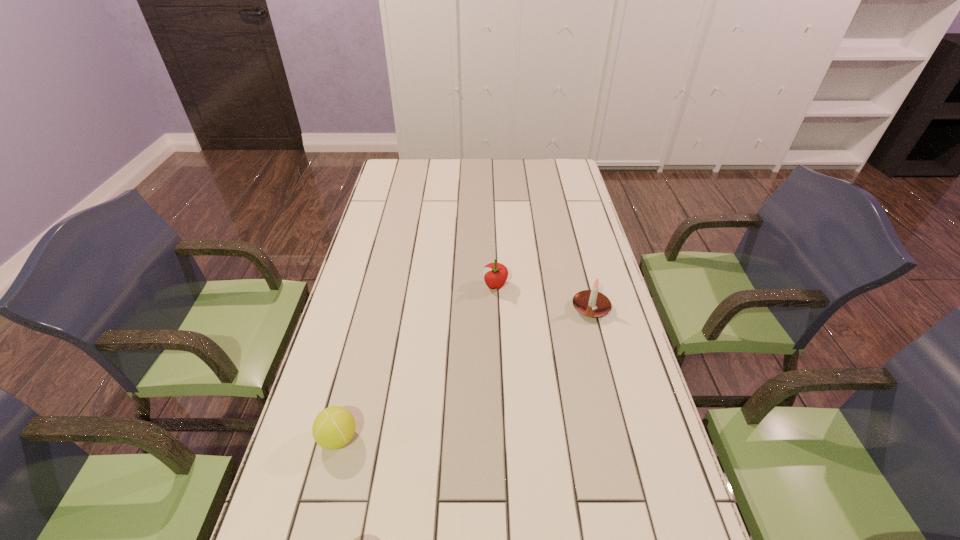
Identify the location of object that is the closest one to the farthest object. The height and width of the screenshot is (540, 960). (591, 303).

Choose which object is the second nearest neighbor to the second object from left to right. Please provide its 2D coordinates. Your answer should be formatted as a tuple, i.e. [(x, y)], where the tuple contains the x and y coordinates of a point satisfying the conditions above.

[(334, 427)]

This screenshot has width=960, height=540. I want to click on free space that satisfies the following two spatial constraints: 1. on the back side of the nearest object; 2. on the right side of the farthest object, so click(377, 286).

This screenshot has width=960, height=540. Find the location of `vacant space that satisfies the following two spatial constraints: 1. on the front side of the rightmost object; 2. on the left side of the second object from left to right`. vacant space that satisfies the following two spatial constraints: 1. on the front side of the rightmost object; 2. on the left side of the second object from left to right is located at coordinates (496, 308).